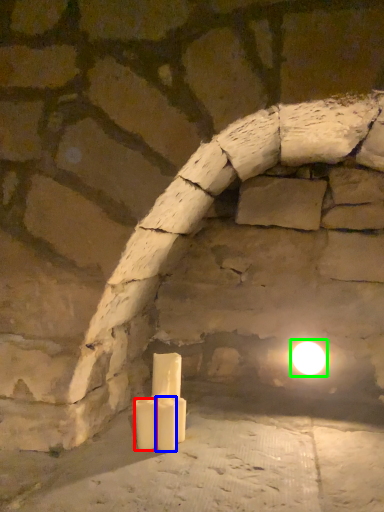
Question: Estimate the real-world distances between objects in this image. Which object is closer to candle (highlighted by a red box), candle (highlighted by a blue box) or moonlight (highlighted by a green box)?

Choices:
 (A) candle
 (B) moonlight

Answer: (A)